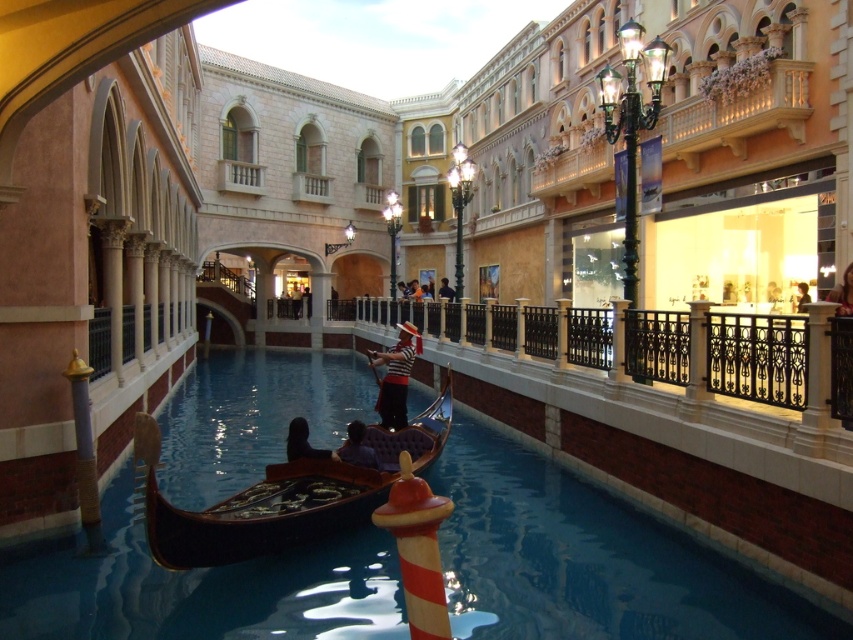
Find the location of a particular element. The height and width of the screenshot is (640, 853). black wrought iron railing at center is located at coordinates (758, 356).

Is black wrought iron railing at center below smooth black gondola at center?

Actually, black wrought iron railing at center is above smooth black gondola at center.

Image resolution: width=853 pixels, height=640 pixels. What do you see at coordinates (758, 356) in the screenshot?
I see `black wrought iron railing at center` at bounding box center [758, 356].

Locate an element on the screen. black wrought iron railing at center is located at coordinates (758, 356).

Is smooth black gondola at center wider than dark fabric person at center?

No.

Which is more to the left, smooth black gondola at center or dark fabric person at center?

dark fabric person at center is more to the left.

The image size is (853, 640). What do you see at coordinates (357, 448) in the screenshot?
I see `smooth black gondola at center` at bounding box center [357, 448].

Locate an element on the screen. Image resolution: width=853 pixels, height=640 pixels. smooth black gondola at center is located at coordinates (357, 448).

Does striped fabric gondolier at center lie in front of light brown leather jacket at upper right?

Yes, striped fabric gondolier at center is closer to the viewer.

Can you confirm if striped fabric gondolier at center is taller than light brown leather jacket at upper right?

Correct, striped fabric gondolier at center is much taller as light brown leather jacket at upper right.

Who is more forward, (x=398, y=400) or (x=807, y=298)?

Point (x=398, y=400)

Where is `striped fabric gondolier at center`? This screenshot has height=640, width=853. striped fabric gondolier at center is located at coordinates (395, 376).